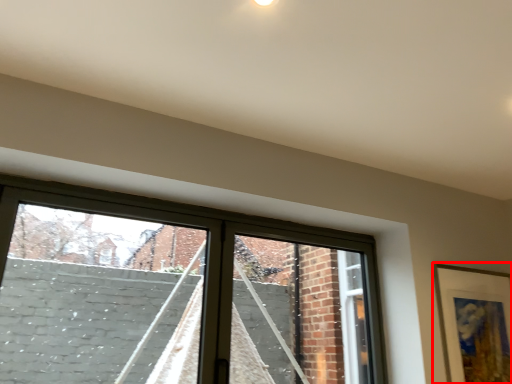
Question: From the image's perspective, where is picture frame (annotated by the red box) located in relation to window in the image?

Choices:
 (A) below
 (B) above

Answer: (A)